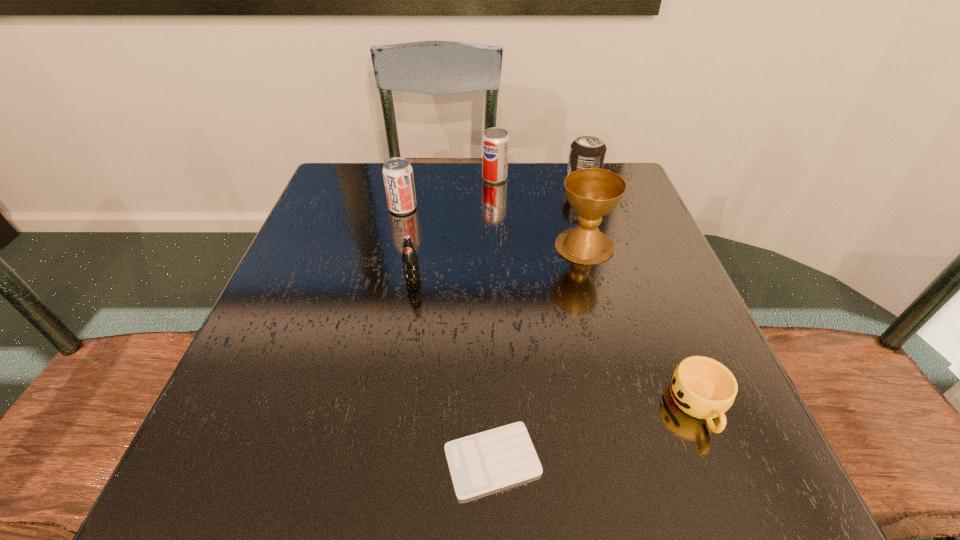
Image resolution: width=960 pixels, height=540 pixels. In order to click on vacant space in between the leftmost pop and the sixth tallest object in this screenshot , I will do `click(551, 307)`.

Locate an element on the screen. The width and height of the screenshot is (960, 540). free space between the cup and the leftmost object is located at coordinates (551, 307).

At what (x,y) coordinates should I click in order to perform the action: click on free space between the leftmost object and the second pop from right to left. Please return your answer as a coordinate pair (x, y). Looking at the image, I should click on (448, 193).

Find the location of a particular element. The width and height of the screenshot is (960, 540). vacant area that lies between the fourth farthest object and the fifth farthest object is located at coordinates coord(499,263).

Locate an element on the screen. The height and width of the screenshot is (540, 960). free space between the calculator and the cup is located at coordinates (596, 433).

I want to click on free point between the cup and the third pop from left to right, so click(x=597, y=292).

Where is `vacant space that's between the leftmost object and the calculator`? The image size is (960, 540). vacant space that's between the leftmost object and the calculator is located at coordinates (447, 334).

Locate which object ranks in proximity to the calculator. Please provide its 2D coordinates. Your answer should be formatted as a tuple, i.e. [(x, y)], where the tuple contains the x and y coordinates of a point satisfying the conditions above.

[(702, 387)]

Locate an element on the screen. object that is the third nearest to the shortest object is located at coordinates (592, 192).

Point out which pop is positioned as the third nearest to the fifth farthest object. Please provide its 2D coordinates. Your answer should be formatted as a tuple, i.e. [(x, y)], where the tuple contains the x and y coordinates of a point satisfying the conditions above.

[(588, 150)]